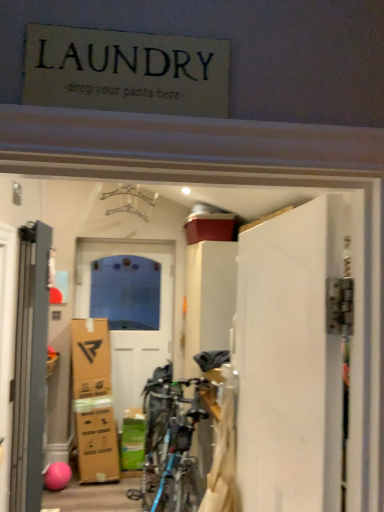
Question: Is gray matte door at left, arranged as the second door when viewed from the back, not within white matte door at right, arranged as the 1th door when viewed from the front?

Choices:
 (A) yes
 (B) no

Answer: (A)

Question: Is gray matte door at left, which ranks as the 2th door in front-to-back order, positioned before white matte door at right, placed as the 1th door when sorted from right to left?

Choices:
 (A) yes
 (B) no

Answer: (B)

Question: Is gray matte door at left, which ranks as the second door in left-to-right order, to the left of white matte door at right, marked as the third door in a back-to-front arrangement, from the viewer's perspective?

Choices:
 (A) no
 (B) yes

Answer: (B)

Question: From a real-world perspective, is gray matte door at left, which ranks as the second door in left-to-right order, located beneath white matte door at right, placed as the 1th door when sorted from right to left?

Choices:
 (A) no
 (B) yes

Answer: (B)

Question: Is gray matte door at left, arranged as the second door when viewed from the back, facing away from white matte door at right, which ranks as the 3th door in left-to-right order?

Choices:
 (A) no
 (B) yes

Answer: (A)

Question: Looking at the image, does white matte door at right, arranged as the 1th door when viewed from the front, seem bigger or smaller compared to gray matte door at left, which is counted as the second door, starting from the right?

Choices:
 (A) small
 (B) big

Answer: (B)

Question: From a real-world perspective, is white matte door at right, arranged as the 1th door when viewed from the front, physically located above or below gray matte door at left, which is counted as the second door, starting from the right?

Choices:
 (A) above
 (B) below

Answer: (A)

Question: In the image, is white matte door at right, marked as the third door in a back-to-front arrangement, on the left side or the right side of gray matte door at left, which is counted as the second door, starting from the right?

Choices:
 (A) left
 (B) right

Answer: (B)

Question: Would you say white matte door at right, marked as the third door in a back-to-front arrangement, is inside or outside gray matte door at left, which ranks as the second door in left-to-right order?

Choices:
 (A) inside
 (B) outside

Answer: (B)

Question: From the image's perspective, relative to gray matte door at left, which is counted as the second door, starting from the right, is white glossy door at center, marked as the 3th door in a right-to-left arrangement, above or below?

Choices:
 (A) below
 (B) above

Answer: (A)

Question: In terms of width, does white glossy door at center, placed as the first door when sorted from left to right, look wider or thinner when compared to gray matte door at left, which ranks as the second door in left-to-right order?

Choices:
 (A) wide
 (B) thin

Answer: (B)

Question: Relative to gray matte door at left, which is counted as the second door, starting from the right, is white glossy door at center, acting as the 3th door starting from the front, in front or behind?

Choices:
 (A) behind
 (B) front

Answer: (A)

Question: Based on their sizes in the image, would you say white glossy door at center, marked as the 3th door in a right-to-left arrangement, is bigger or smaller than gray matte door at left, which is counted as the second door, starting from the right?

Choices:
 (A) small
 (B) big

Answer: (B)

Question: Is gray matte door at left, which ranks as the 2th door in front-to-back order, spatially inside white glossy door at center, placed as the first door when sorted from left to right, or outside of it?

Choices:
 (A) inside
 (B) outside

Answer: (B)

Question: From the image's perspective, is gray matte door at left, which is counted as the second door, starting from the right, located above or below white glossy door at center, marked as the 3th door in a right-to-left arrangement?

Choices:
 (A) above
 (B) below

Answer: (A)